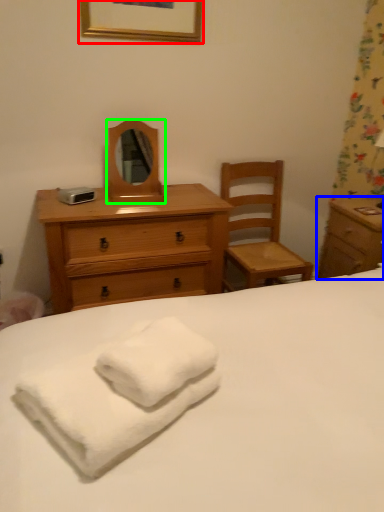
Question: Which is nearer to the picture frame (highlighted by a red box)? nightstand (highlighted by a blue box) or mirror (highlighted by a green box).

Choices:
 (A) nightstand
 (B) mirror

Answer: (B)